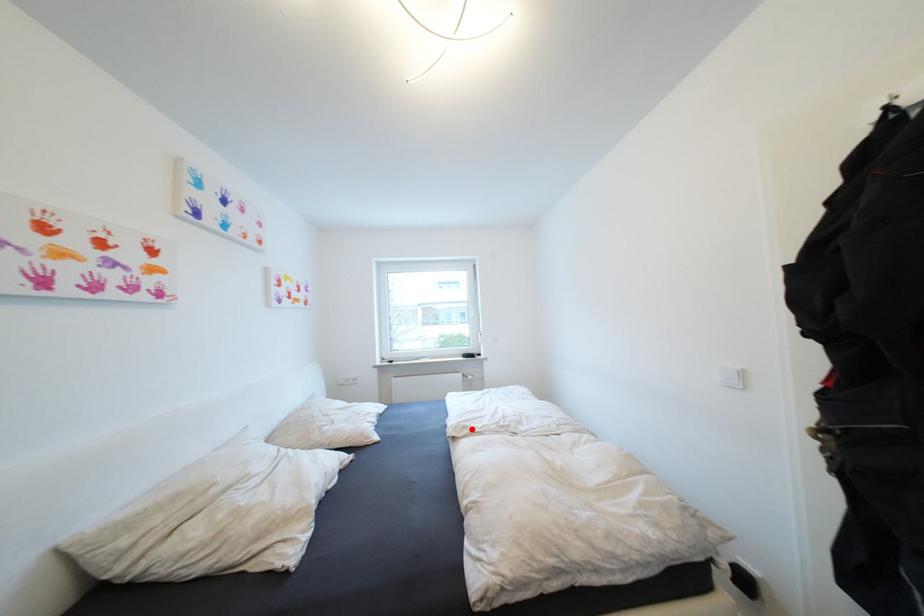
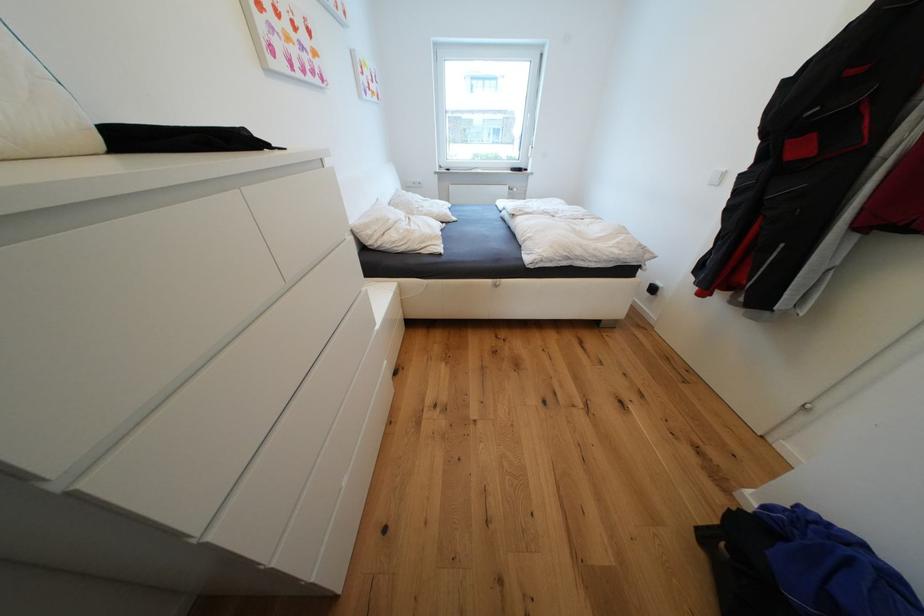
In the second image, find the point that corresponds to the highlighted location in the first image.

(528, 212)